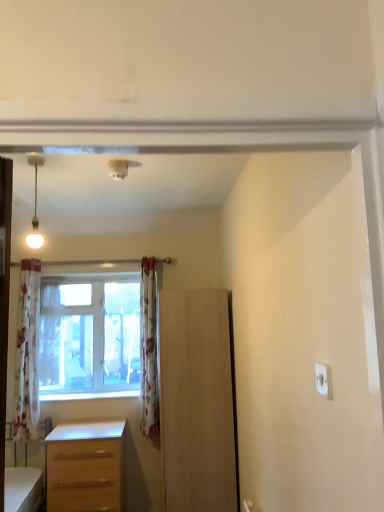
Question: Is light brown wooden desk at lower left bigger than white floral curtain at center, the second curtain from the right?

Choices:
 (A) no
 (B) yes

Answer: (B)

Question: From a real-world perspective, is light brown wooden desk at lower left positioned under white floral curtain at center, which is the 2th curtain from left to right, based on gravity?

Choices:
 (A) yes
 (B) no

Answer: (A)

Question: Considering the relative positions of light brown wooden desk at lower left and white floral curtain at center, the second curtain from the right, in the image provided, is light brown wooden desk at lower left behind white floral curtain at center, the second curtain from the right,?

Choices:
 (A) no
 (B) yes

Answer: (A)

Question: Is white floral curtain at center, the second curtain from the right, at the back of light brown wooden desk at lower left?

Choices:
 (A) no
 (B) yes

Answer: (A)

Question: Considering the relative positions of light brown wooden desk at lower left and white floral curtain at center, the second curtain from the right, in the image provided, is light brown wooden desk at lower left to the right of white floral curtain at center, the second curtain from the right, from the viewer's perspective?

Choices:
 (A) no
 (B) yes

Answer: (B)

Question: Can you confirm if light brown wooden desk at lower left is positioned to the left of white floral curtain at center, the second curtain from the right?

Choices:
 (A) no
 (B) yes

Answer: (A)

Question: Considering the relative sizes of floral fabric curtain at center, positioned as the first curtain in right-to-left order, and light brown wood cabinet at center in the image provided, is floral fabric curtain at center, positioned as the first curtain in right-to-left order, bigger than light brown wood cabinet at center?

Choices:
 (A) yes
 (B) no

Answer: (B)

Question: Could light brown wood cabinet at center be considered to be inside floral fabric curtain at center, the third curtain in the left-to-right sequence?

Choices:
 (A) no
 (B) yes

Answer: (A)

Question: Is floral fabric curtain at center, the third curtain in the left-to-right sequence, in contact with light brown wood cabinet at center?

Choices:
 (A) yes
 (B) no

Answer: (B)

Question: Does floral fabric curtain at center, positioned as the first curtain in right-to-left order, have a lesser height compared to light brown wood cabinet at center?

Choices:
 (A) no
 (B) yes

Answer: (B)

Question: From a real-world perspective, is floral fabric curtain at center, positioned as the first curtain in right-to-left order, on top of light brown wood cabinet at center?

Choices:
 (A) no
 (B) yes

Answer: (B)

Question: From the image's perspective, is floral fabric curtain at center, positioned as the first curtain in right-to-left order, over light brown wood cabinet at center?

Choices:
 (A) no
 (B) yes

Answer: (B)

Question: Can you confirm if white floral curtain at center, the second curtain from the right, is bigger than floral fabric curtain at center, positioned as the first curtain in right-to-left order?

Choices:
 (A) no
 (B) yes

Answer: (A)